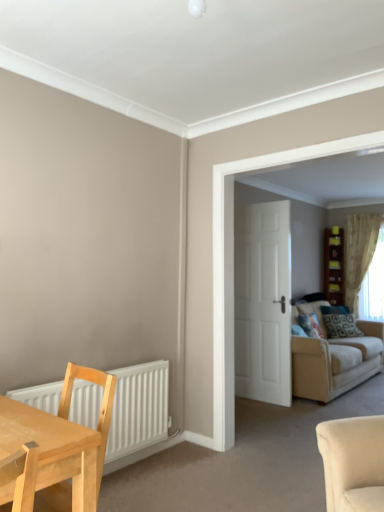
Question: From the image's perspective, is sheer beige curtain at right located above patterned fabric pillow at center-right?

Choices:
 (A) yes
 (B) no

Answer: (A)

Question: Is sheer beige curtain at right at the right side of patterned fabric pillow at center-right?

Choices:
 (A) no
 (B) yes

Answer: (B)

Question: Is sheer beige curtain at right positioned behind patterned fabric pillow at center-right?

Choices:
 (A) no
 (B) yes

Answer: (B)

Question: Is sheer beige curtain at right turned away from patterned fabric pillow at center-right?

Choices:
 (A) no
 (B) yes

Answer: (A)

Question: Is sheer beige curtain at right in contact with patterned fabric pillow at center-right?

Choices:
 (A) yes
 (B) no

Answer: (B)

Question: Does sheer beige curtain at right have a smaller size compared to patterned fabric pillow at center-right?

Choices:
 (A) no
 (B) yes

Answer: (A)

Question: Is white matte door at center positioned with its back to brown wooden bookshelf at center-right?

Choices:
 (A) yes
 (B) no

Answer: (A)

Question: Could you tell me if white matte door at center is turned towards brown wooden bookshelf at center-right?

Choices:
 (A) no
 (B) yes

Answer: (A)

Question: From a real-world perspective, is white matte door at center beneath brown wooden bookshelf at center-right?

Choices:
 (A) yes
 (B) no

Answer: (A)

Question: Considering the relative sizes of white matte door at center and brown wooden bookshelf at center-right in the image provided, is white matte door at center taller than brown wooden bookshelf at center-right?

Choices:
 (A) no
 (B) yes

Answer: (B)

Question: Can you confirm if white matte door at center is shorter than brown wooden bookshelf at center-right?

Choices:
 (A) yes
 (B) no

Answer: (B)

Question: Is white matte door at center to the right of brown wooden bookshelf at center-right from the viewer's perspective?

Choices:
 (A) yes
 (B) no

Answer: (B)

Question: Is patterned fabric pillow at center-right closer to the viewer compared to beige fabric couch at right?

Choices:
 (A) no
 (B) yes

Answer: (A)